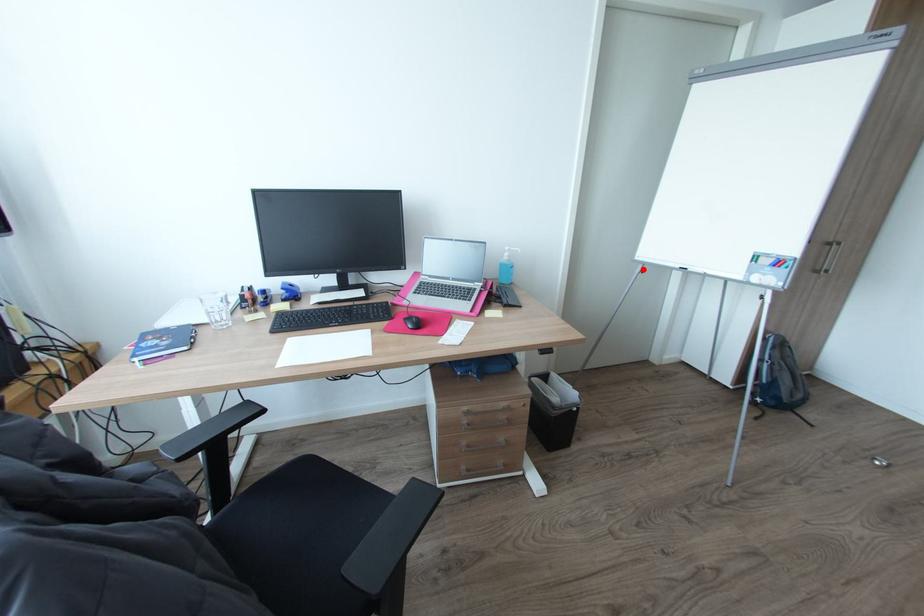
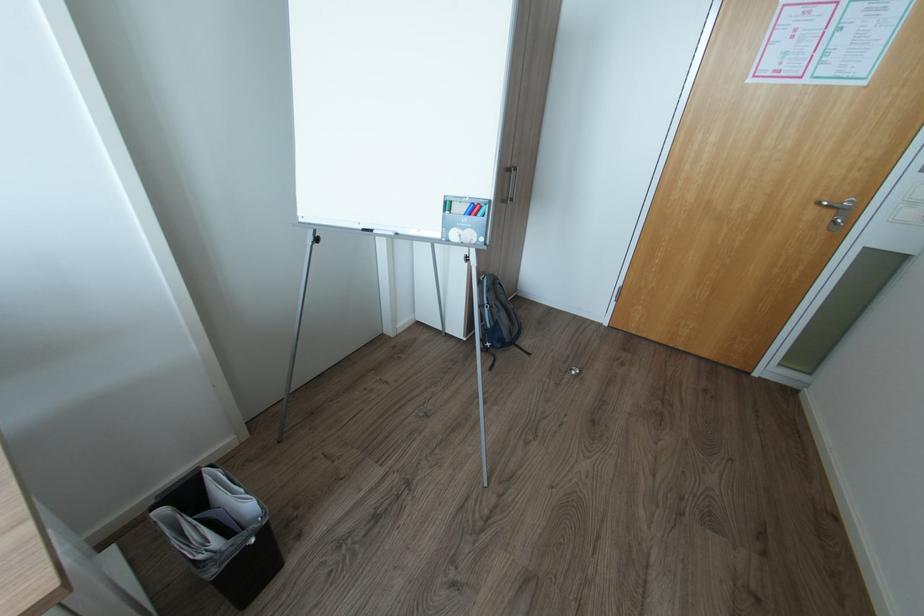
Question: I am providing you with two images of the same scene from different viewpoints. A red point is shown in image1. For the corresponding object point in image2, is it positioned nearer or farther from the camera?

Choices:
 (A) Nearer
 (B) Farther

Answer: (B)